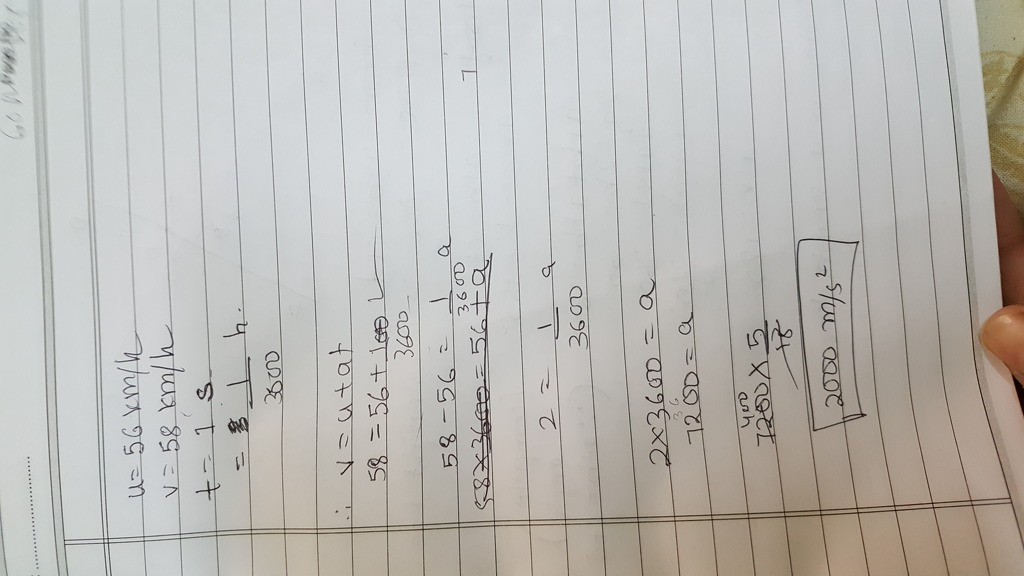
Find the location of a particular element. pen is located at coordinates (502, 363).